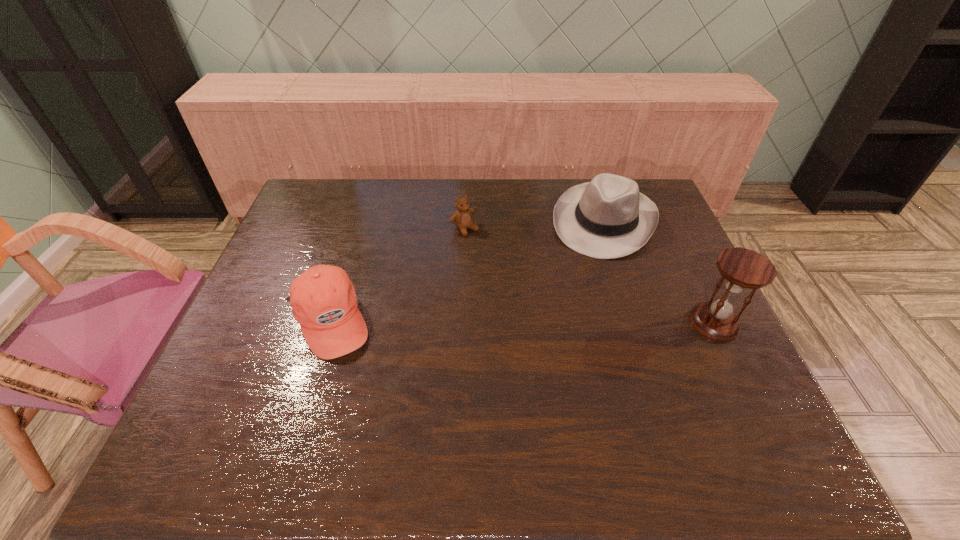
Locate an element on the screen. vacant space that satisfies the following two spatial constraints: 1. on the back side of the third object from right to left; 2. on the right side of the fedora is located at coordinates (465, 221).

Identify the location of free location that satisfies the following two spatial constraints: 1. on the back side of the shortest object; 2. on the right side of the fedora. (465, 221).